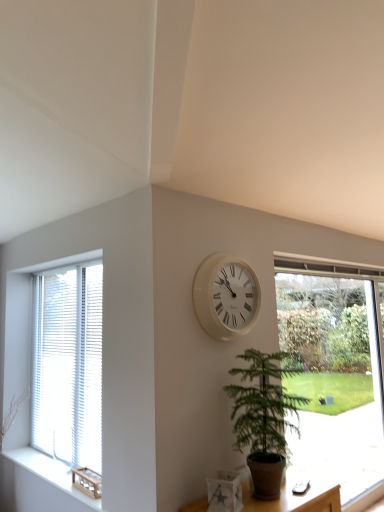
Locate an element on the screen. This screenshot has width=384, height=512. white plastic clock at center is located at coordinates (226, 297).

This screenshot has width=384, height=512. Describe the element at coordinates (226, 297) in the screenshot. I see `white plastic clock at center` at that location.

The height and width of the screenshot is (512, 384). I want to click on green leafy plant at center, so click(263, 418).

Measure the distance between green leafy plant at center and camera.

green leafy plant at center is 6.81 feet away from camera.

At what (x,y) coordinates should I click in order to perform the action: click on white matte vase at lower center. Please return your answer as a coordinate pair (x, y). The height and width of the screenshot is (512, 384). Looking at the image, I should click on (297, 499).

The image size is (384, 512). What do you see at coordinates (297, 499) in the screenshot?
I see `white matte vase at lower center` at bounding box center [297, 499].

What is the approximate width of woodenmaterial/texturewindow sill at left?

22.97 centimeters.

How much space does white wood blinds at left, which is counted as the 2th window, starting from the right, occupy vertically?

white wood blinds at left, which is counted as the 2th window, starting from the right, is 1.43 meters tall.

What do you see at coordinates (336, 367) in the screenshot?
I see `transparent glass window at right, arranged as the first window when viewed from the right` at bounding box center [336, 367].

You are a GUI agent. You are given a task and a screenshot of the screen. Output one action in this format:
    pyautogui.click(x=<x>, y=<y>)
    Task: Click on the white plastic clock at center
    
    Given the screenshot: What is the action you would take?
    pyautogui.click(x=226, y=297)

Who is smaller, white plastic clock at center or transparent glass window at right, arranged as the first window when viewed from the right?

Smaller between the two is white plastic clock at center.

Considering the sizes of objects white plastic clock at center and transparent glass window at right, arranged as the first window when viewed from the right, in the image provided, who is thinner, white plastic clock at center or transparent glass window at right, arranged as the first window when viewed from the right,?

transparent glass window at right, arranged as the first window when viewed from the right.

Is point (216, 256) less distant than point (305, 412)?

Yes, it is in front of point (305, 412).

Relative to transparent glass window at right, arranged as the first window when viewed from the right, is white plastic clock at center in front or behind?

white plastic clock at center is positioned closer to the viewer than transparent glass window at right, arranged as the first window when viewed from the right.

Between white wood blinds at left, acting as the first window starting from the left, and white matte vase at lower center, which one has more height?

Standing taller between the two is white wood blinds at left, acting as the first window starting from the left.

Considering the relative sizes of white wood blinds at left, acting as the first window starting from the left, and white matte vase at lower center in the image provided, is white wood blinds at left, acting as the first window starting from the left, wider than white matte vase at lower center?

No.

Based on their positions, is white wood blinds at left, which is counted as the 2th window, starting from the right, located to the left or right of white matte vase at lower center?

white wood blinds at left, which is counted as the 2th window, starting from the right, is positioned on white matte vase at lower center's left side.

Is white wood blinds at left, which is counted as the 2th window, starting from the right, outside of white matte vase at lower center?

white wood blinds at left, which is counted as the 2th window, starting from the right, is positioned outside white matte vase at lower center.

How many degrees apart are the facing directions of white matte vase at lower center and white wood blinds at left, acting as the first window starting from the left?

The angle between the facing direction of white matte vase at lower center and the facing direction of white wood blinds at left, acting as the first window starting from the left, is 89.8 degrees.

Considering the positions of objects white matte vase at lower center and white wood blinds at left, acting as the first window starting from the left, in the image provided, who is more to the right, white matte vase at lower center or white wood blinds at left, acting as the first window starting from the left,?

From the viewer's perspective, white matte vase at lower center appears more on the right side.

Is white matte vase at lower center aimed at white wood blinds at left, acting as the first window starting from the left?

No, white matte vase at lower center is not oriented towards white wood blinds at left, acting as the first window starting from the left.

From a real-world perspective, which object stands above the other?

From a 3D spatial view, white wood blinds at left, acting as the first window starting from the left, is above.

Looking at this image, could green leafy plant at center be considered to be inside white wood blinds at left, which is counted as the 2th window, starting from the right?

No, white wood blinds at left, which is counted as the 2th window, starting from the right, does not contain green leafy plant at center.

From a real-world perspective, who is located lower, white wood blinds at left, which is counted as the 2th window, starting from the right, or green leafy plant at center?

In real-world perspective, green leafy plant at center is lower.

Which object is thinner, white wood blinds at left, which is counted as the 2th window, starting from the right, or green leafy plant at center?

white wood blinds at left, which is counted as the 2th window, starting from the right.

Based on the photo, who is more distant, white wood blinds at left, which is counted as the 2th window, starting from the right, or green leafy plant at center?

white wood blinds at left, which is counted as the 2th window, starting from the right, is behind.

What's the angular difference between green leafy plant at center and woodenmaterial/texturewindow sill at left's facing directions?

The angular difference between green leafy plant at center and woodenmaterial/texturewindow sill at left is 91.1 degrees.

Is green leafy plant at center in front of or behind woodenmaterial/texturewindow sill at left in the image?

green leafy plant at center is in front of woodenmaterial/texturewindow sill at left.

Which is more to the left, green leafy plant at center or woodenmaterial/texturewindow sill at left?

woodenmaterial/texturewindow sill at left.

From the image's perspective, which one is positioned higher, green leafy plant at center or woodenmaterial/texturewindow sill at left?

From the image's view, green leafy plant at center is above.

Who is smaller, white wood blinds at left, which is counted as the 2th window, starting from the right, or transparent glass window at right, arranged as the first window when viewed from the right?

white wood blinds at left, which is counted as the 2th window, starting from the right.

From the image's perspective, is white wood blinds at left, which is counted as the 2th window, starting from the right, on top of transparent glass window at right, arranged as the second window when viewed from the left?

Yes.

Can you confirm if white wood blinds at left, acting as the first window starting from the left, is positioned to the right of transparent glass window at right, arranged as the second window when viewed from the left?

No, white wood blinds at left, acting as the first window starting from the left, is not to the right of transparent glass window at right, arranged as the second window when viewed from the left.

Does point (90, 378) come in front of point (285, 279)?

Yes, point (90, 378) is closer to viewer.

Who is shorter, green leafy plant at center or white matte vase at lower center?

With less height is white matte vase at lower center.

Is white matte vase at lower center a part of green leafy plant at center?

That's incorrect, white matte vase at lower center is not inside green leafy plant at center.

In the scene shown: In terms of width, does green leafy plant at center look wider or thinner when compared to white matte vase at lower center?

Clearly, green leafy plant at center has more width compared to white matte vase at lower center.

Which of these two, green leafy plant at center or white matte vase at lower center, is smaller?

With smaller size is white matte vase at lower center.

Locate an element on the screen. The image size is (384, 512). window that is the 2nd object located below the white plastic clock at center (from the image's perspective) is located at coordinates (336, 367).

Locate an element on the screen. The image size is (384, 512). furniture below the white wood blinds at left, which is counted as the 2th window, starting from the right (from a real-world perspective) is located at coordinates pyautogui.click(x=297, y=499).

When comparing their distances from green leafy plant at center, does white plastic clock at center or white wood blinds at left, acting as the first window starting from the left, seem closer?

Among the two, white plastic clock at center is located nearer to green leafy plant at center.

When comparing their distances from white plastic clock at center, does white matte vase at lower center or white wood blinds at left, which is counted as the 2th window, starting from the right, seem further?

The object further to white plastic clock at center is white wood blinds at left, which is counted as the 2th window, starting from the right.

Which object lies further to the anchor point woodenmaterial/texturewindow sill at left, green leafy plant at center or white plastic clock at center?

white plastic clock at center is positioned further to the anchor woodenmaterial/texturewindow sill at left.

Estimate the real-world distances between objects in this image. Which object is further from transparent glass window at right, arranged as the second window when viewed from the left, white matte vase at lower center or white wood blinds at left, which is counted as the 2th window, starting from the right?

white wood blinds at left, which is counted as the 2th window, starting from the right, lies further to transparent glass window at right, arranged as the second window when viewed from the left, than the other object.

Based on the photo, which object lies further to the anchor point transparent glass window at right, arranged as the second window when viewed from the left, green leafy plant at center or white matte vase at lower center?

white matte vase at lower center lies further to transparent glass window at right, arranged as the second window when viewed from the left, than the other object.

Looking at the image, which one is located closer to white plastic clock at center, white matte vase at lower center or green leafy plant at center?

Among the two, green leafy plant at center is located nearer to white plastic clock at center.

From the image, which object appears to be farther from white wood blinds at left, acting as the first window starting from the left, woodenmaterial/texturewindow sill at left or transparent glass window at right, arranged as the first window when viewed from the right?

transparent glass window at right, arranged as the first window when viewed from the right, is further to white wood blinds at left, acting as the first window starting from the left.

From the image, which object appears to be nearer to woodenmaterial/texturewindow sill at left, green leafy plant at center or white wood blinds at left, acting as the first window starting from the left?

The object closer to woodenmaterial/texturewindow sill at left is white wood blinds at left, acting as the first window starting from the left.

Identify the location of wall clock located between woodenmaterial/texturewindow sill at left and white matte vase at lower center in the left-right direction. Image resolution: width=384 pixels, height=512 pixels. (226, 297).

This screenshot has height=512, width=384. I want to click on wall clock between white wood blinds at left, which is counted as the 2th window, starting from the right, and green leafy plant at center from left to right, so click(x=226, y=297).

This screenshot has height=512, width=384. Identify the location of furniture located between woodenmaterial/texturewindow sill at left and green leafy plant at center in the left-right direction. (297, 499).

In order to click on furniture located between woodenmaterial/texturewindow sill at left and transparent glass window at right, arranged as the first window when viewed from the right, in the left-right direction in this screenshot , I will do `click(297, 499)`.